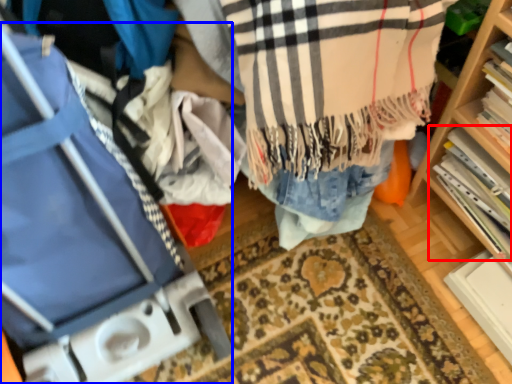
Question: Which point is closer to the camera, book (highlighted by a red box) or luggage (highlighted by a blue box)?

Choices:
 (A) book
 (B) luggage

Answer: (B)